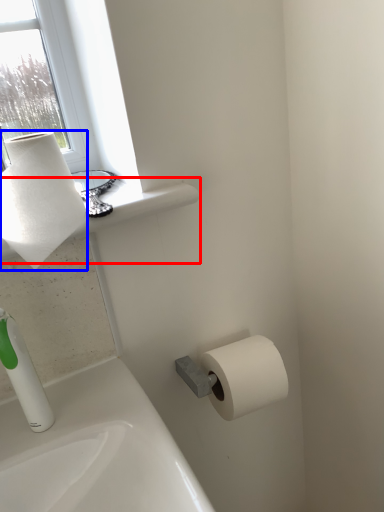
Question: Which object appears closest to the camera in this image, window sill (highlighted by a red box) or paper towel (highlighted by a blue box)?

Choices:
 (A) window sill
 (B) paper towel

Answer: (B)